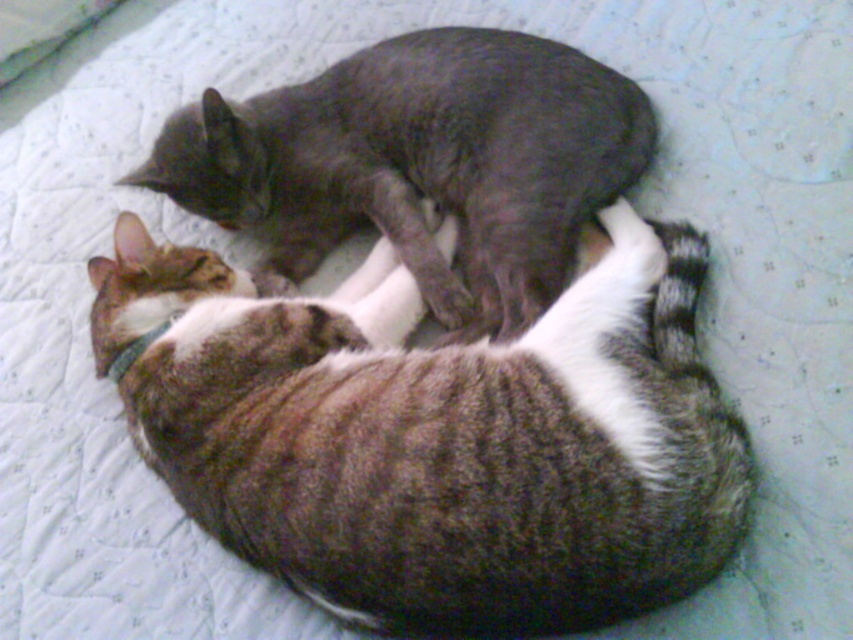
You are a photographer taking a picture of two cats resting on a quilted surface. You want to ensure that both cats are clearly visible in the photo. Given their positions at point coordinates point (x=296, y=548) and point (x=527, y=132), which cat should you focus on first to ensure both are in focus?

You should focus on the cat at point (x=296, y=548) first because it is closer to the camera. Since it is in front of the cat at point (x=527, y=132), focusing on the closer cat will help ensure both are in focus as the depth of field may naturally include the background cat.

You are a photographer trying to capture a closeup of the gray smooth cat at upper center. However, the tabby fur cat at lower center is blocking your view. Can you adjust your position to get a clear shot without moving the cats?

The tabby fur cat at lower center is closer to the viewer than the gray smooth cat at upper center. To get a clear shot of the gray smooth cat at upper center, you need to move your camera position so that the tabby fur cat at lower center is no longer in front of it.

Based on the scene description, where is the tabby fur cat at lower center located in terms of its 2D coordinates?

The tabby fur cat at lower center is located at the 2D coordinates of point (437, 435).